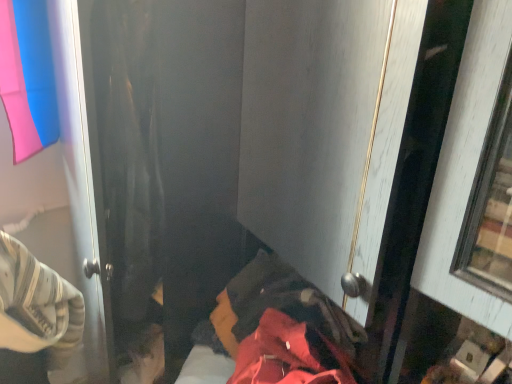
Question: From a real-world perspective, relative to red fabric bed at lower center, is pink fabric at upper left vertically above or below?

Choices:
 (A) below
 (B) above

Answer: (B)

Question: Is point click(96, 231) closer or farther from the camera than point click(262, 352)?

Choices:
 (A) farther
 (B) closer

Answer: (B)

Question: In the image, is pink fabric at upper left on the left side or the right side of red fabric bed at lower center?

Choices:
 (A) right
 (B) left

Answer: (B)

Question: Relative to pink fabric at upper left, is red fabric bed at lower center in front or behind?

Choices:
 (A) behind
 (B) front

Answer: (B)

Question: Looking at their shapes, would you say red fabric bed at lower center is wider or thinner than pink fabric at upper left?

Choices:
 (A) thin
 (B) wide

Answer: (B)

Question: Based on their positions, is red fabric bed at lower center located to the left or right of pink fabric at upper left?

Choices:
 (A) right
 (B) left

Answer: (A)

Question: From the image's perspective, is red fabric bed at lower center positioned above or below pink fabric at upper left?

Choices:
 (A) above
 (B) below

Answer: (B)